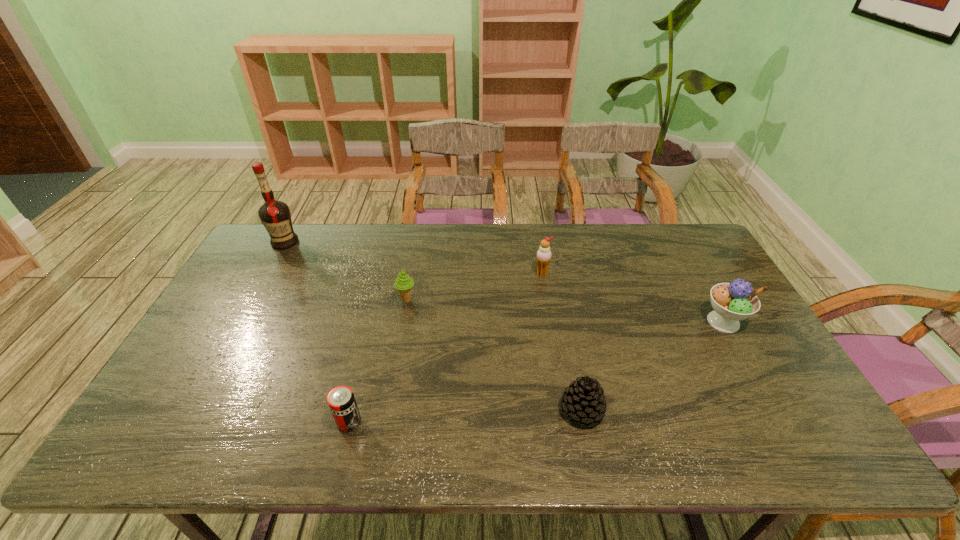
Locate an element on the screen. The width and height of the screenshot is (960, 540). liquor is located at coordinates (275, 215).

I want to click on the farthest object, so click(275, 215).

The height and width of the screenshot is (540, 960). In order to click on the rightmost object in this screenshot , I will do `click(732, 302)`.

The image size is (960, 540). What are the coordinates of `the farthest icecream` in the screenshot? It's located at (543, 256).

The width and height of the screenshot is (960, 540). I want to click on the second farthest object, so click(543, 256).

At what (x,y) coordinates should I click in order to perform the action: click on the shortest icecream. Please return your answer as a coordinate pair (x, y). The width and height of the screenshot is (960, 540). Looking at the image, I should click on (403, 283).

What are the coordinates of `the third object from left to right` in the screenshot? It's located at [x=403, y=283].

Locate an element on the screen. pinecone is located at coordinates (584, 402).

Find the location of a particular element. Image resolution: width=960 pixels, height=540 pixels. can is located at coordinates (341, 400).

At what (x,y) coordinates should I click in order to perform the action: click on vacant region located on the front and back of the farthest object. Please return your answer as a coordinate pair (x, y). The width and height of the screenshot is (960, 540). Looking at the image, I should click on (247, 310).